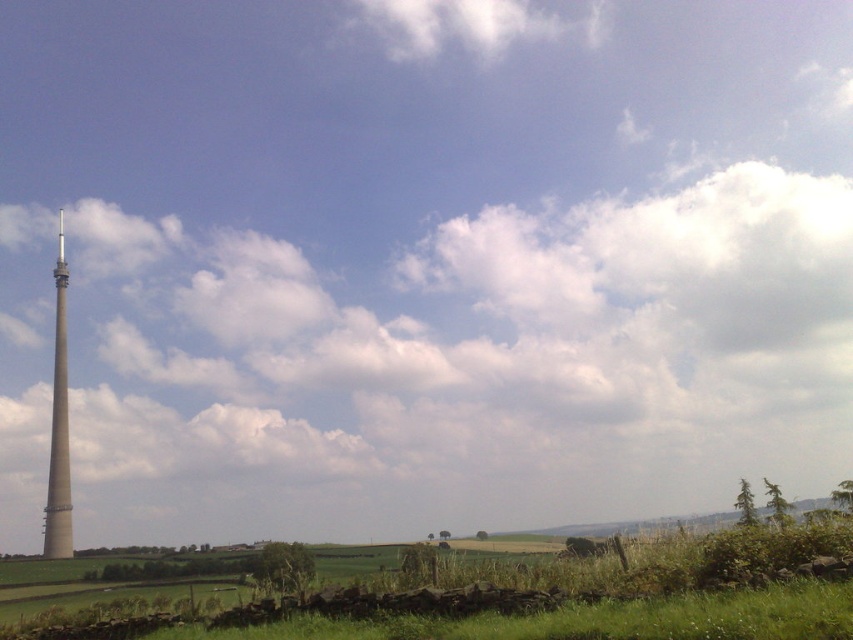
Question: Which of the following is the closest to the observer?

Choices:
 (A) (56, 360)
 (B) (61, 218)
 (C) (653, 589)

Answer: (C)

Question: Among these objects, which one is farthest from the camera?

Choices:
 (A) beige concrete tower at left
 (B) green grassy field at lower center

Answer: (A)

Question: Which is nearer to the green grassy field at lower center?

Choices:
 (A) smooth white spire at left
 (B) beige concrete tower at left

Answer: (B)

Question: Is green grassy field at lower center positioned behind beige concrete tower at left?

Choices:
 (A) yes
 (B) no

Answer: (B)

Question: Can you confirm if green grassy field at lower center is thinner than beige concrete tower at left?

Choices:
 (A) yes
 (B) no

Answer: (B)

Question: Does green grassy field at lower center appear on the right side of beige concrete tower at left?

Choices:
 (A) no
 (B) yes

Answer: (B)